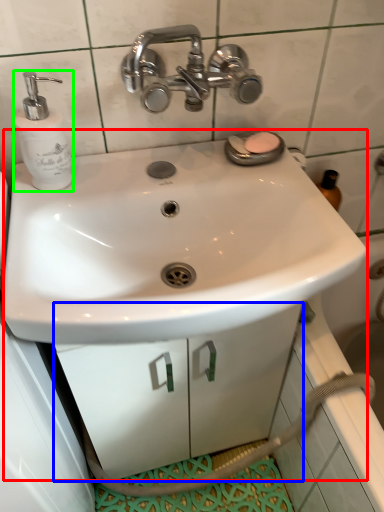
Question: Which is nearer to the sink (highlighted by a red box)? drawer (highlighted by a blue box) or soap dispenser (highlighted by a green box).

Choices:
 (A) drawer
 (B) soap dispenser

Answer: (A)